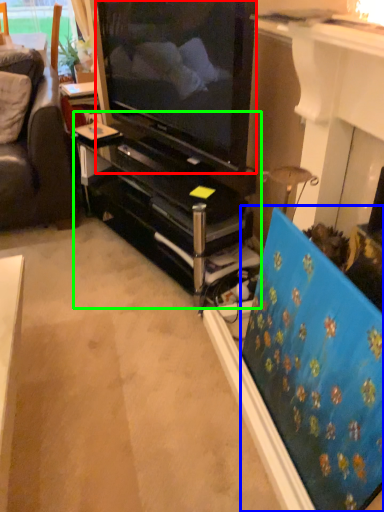
Question: Estimate the real-world distances between objects in this image. Which object is closer to television (highlighted by a red box), flat (highlighted by a blue box) or tv cabinet (highlighted by a green box)?

Choices:
 (A) flat
 (B) tv cabinet

Answer: (B)